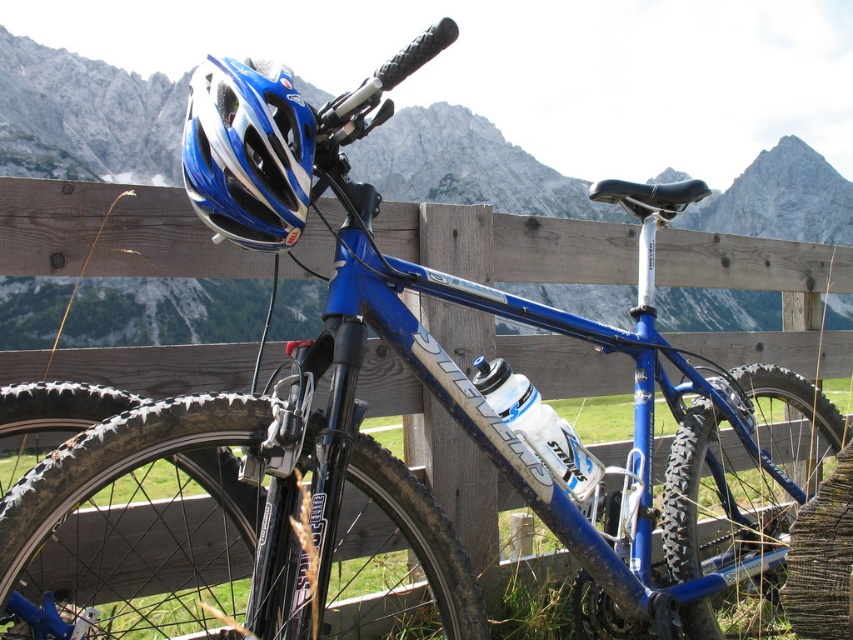
Question: Can you confirm if blue glossy helmet at upper left is positioned below white glossy water bottle at center?

Choices:
 (A) yes
 (B) no

Answer: (B)

Question: Considering the relative positions of blue glossy helmet at upper left and white glossy water bottle at center in the image provided, where is blue glossy helmet at upper left located with respect to white glossy water bottle at center?

Choices:
 (A) left
 (B) right

Answer: (A)

Question: Which object appears closest to the camera in this image?

Choices:
 (A) blue glossy helmet at upper left
 (B) white glossy water bottle at center

Answer: (A)

Question: Which point is farther from the camera taking this photo?

Choices:
 (A) (276, 76)
 (B) (521, 426)

Answer: (B)

Question: Which object appears farthest from the camera in this image?

Choices:
 (A) white glossy water bottle at center
 (B) blue glossy helmet at upper left

Answer: (A)

Question: Considering the relative positions of blue glossy helmet at upper left and white glossy water bottle at center in the image provided, where is blue glossy helmet at upper left located with respect to white glossy water bottle at center?

Choices:
 (A) below
 (B) above

Answer: (B)